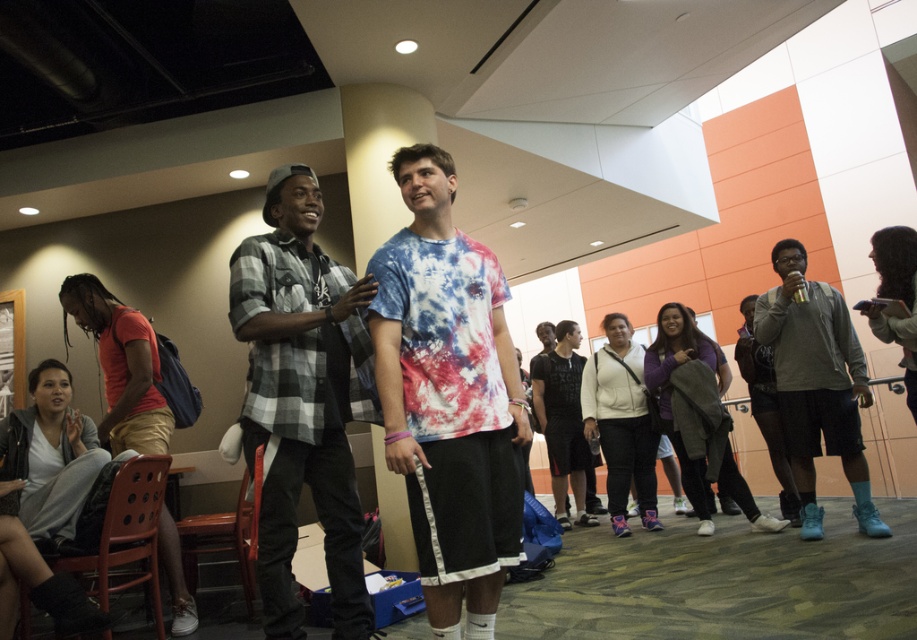
You are at the coordinates of point (236, 540) and want to move towards point (150, 504). Based on the scene description, will you be moving forward or backward?

Since point (150, 504) is in front of point (236, 540), moving towards it would mean moving forward.

You are planning to sit down in the area where the brown plastic chair at lower left and the wooden chair at lower left are located. Which chair would you choose if you prefer a higher seat?

The brown plastic chair at lower left is taller than the wooden chair at lower left, so you should choose the brown plastic chair at lower left for a higher seat.